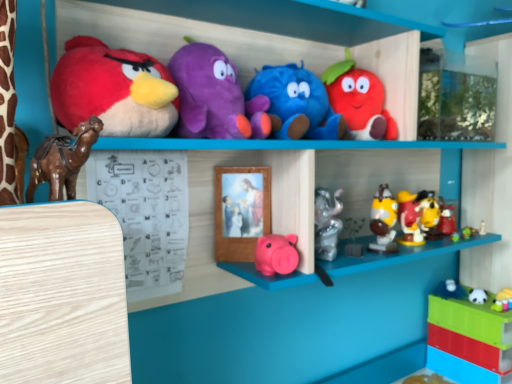
Question: Is blue plush toy at upper center, marked as the 8th toy in a right-to-left arrangement, smaller than shiny plastic toys at center right, which ranks as the 5th toy in right-to-left order?

Choices:
 (A) no
 (B) yes

Answer: (A)

Question: Is shiny plastic toys at center right, which ranks as the 5th toy in right-to-left order, a part of blue plush toy at upper center, placed as the fourth toy when sorted from left to right?

Choices:
 (A) no
 (B) yes

Answer: (A)

Question: Does blue plush toy at upper center, placed as the fourth toy when sorted from left to right, have a lesser width compared to shiny plastic toys at center right, the 7th toy positioned from the left?

Choices:
 (A) yes
 (B) no

Answer: (B)

Question: Is blue plush toy at upper center, placed as the fourth toy when sorted from left to right, closer to camera compared to shiny plastic toys at center right, the 7th toy positioned from the left?

Choices:
 (A) no
 (B) yes

Answer: (B)

Question: Is blue plush toy at upper center, marked as the 8th toy in a right-to-left arrangement, aimed at shiny plastic toys at center right, which ranks as the 5th toy in right-to-left order?

Choices:
 (A) no
 (B) yes

Answer: (A)

Question: In the image, is wooden picture frame at center on the left side or the right side of translucent plastic toy at lower right, which appears as the second toy when viewed from the right?

Choices:
 (A) left
 (B) right

Answer: (A)

Question: From the image's perspective, relative to translucent plastic toy at lower right, which is the 10th toy from left to right, is wooden picture frame at center above or below?

Choices:
 (A) below
 (B) above

Answer: (B)

Question: From a real-world perspective, is wooden picture frame at center physically located above or below translucent plastic toy at lower right, which is the 10th toy from left to right?

Choices:
 (A) below
 (B) above

Answer: (B)

Question: In terms of height, does wooden picture frame at center look taller or shorter compared to translucent plastic toy at lower right, which appears as the second toy when viewed from the right?

Choices:
 (A) tall
 (B) short

Answer: (B)

Question: Relative to shiny plastic toys at center right, which ranks as the 5th toy in right-to-left order, is blue plush toy at upper center, marked as the 8th toy in a right-to-left arrangement, in front or behind?

Choices:
 (A) behind
 (B) front

Answer: (B)

Question: From their relative heights in the image, would you say blue plush toy at upper center, marked as the 8th toy in a right-to-left arrangement, is taller or shorter than shiny plastic toys at center right, which ranks as the 5th toy in right-to-left order?

Choices:
 (A) tall
 (B) short

Answer: (A)

Question: From the image's perspective, is blue plush toy at upper center, marked as the 8th toy in a right-to-left arrangement, above or below shiny plastic toys at center right, which ranks as the 5th toy in right-to-left order?

Choices:
 (A) above
 (B) below

Answer: (A)

Question: Looking at the image, does blue plush toy at upper center, placed as the fourth toy when sorted from left to right, seem bigger or smaller compared to shiny plastic toys at center right, which ranks as the 5th toy in right-to-left order?

Choices:
 (A) small
 (B) big

Answer: (B)

Question: Considering the positions of point (252, 190) and point (480, 291), is point (252, 190) closer or farther from the camera than point (480, 291)?

Choices:
 (A) farther
 (B) closer

Answer: (B)

Question: In terms of height, does wooden picture frame at center look taller or shorter compared to white plush panda at lower right, positioned as the 9th toy in left-to-right order?

Choices:
 (A) short
 (B) tall

Answer: (B)